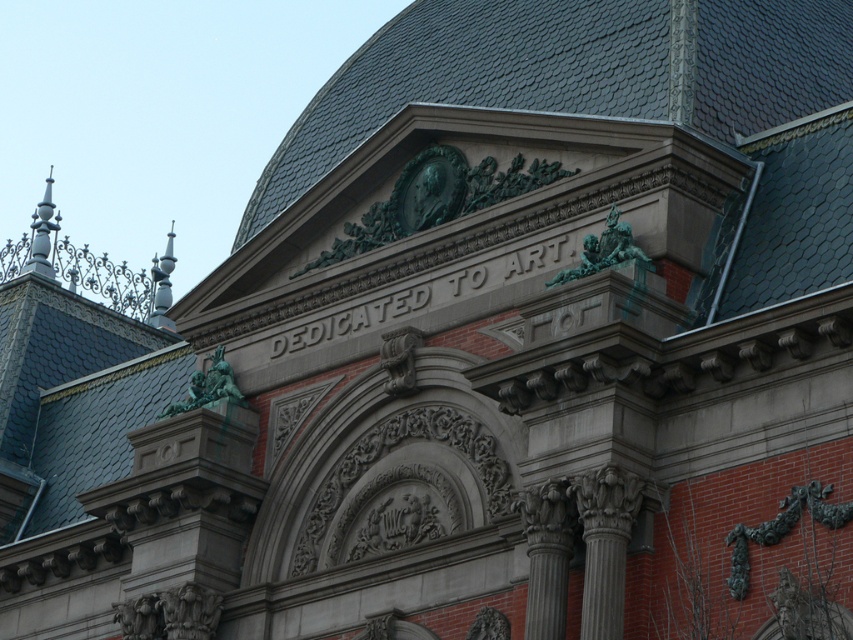
Looking at this image, you are an architect examining the building facade. You need to install a new light fixture between the green patina bust at center and the polished silver spire at upper left. Based on their positions, where should you place the light fixture?

The green patina bust at center is below the polished silver spire at upper left, so the light fixture should be placed between them, above the green patina bust at center and below the polished silver spire at upper left.

You are standing at the entrance of the grand building and looking up. There is a point marked at coordinates point [42,234]. What object is located at this point?

The point [42,234] is where the polished silver spire at upper left is located.

You are standing in front of the grand building and want to determine the relative positions of two points marked on the facade. Which point, point (54, 221) or point (167, 285), is closer to you?

Point (54, 221) is closer to the viewer than point (167, 285).